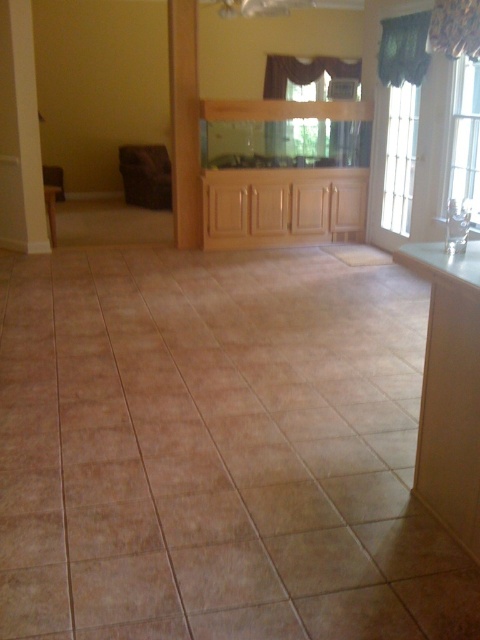
Between brown wood pillar at left and wooden pillar at center, which one has more height?

wooden pillar at center

Which is behind, point (20, 244) or point (180, 246)?

The point (180, 246) is behind.

Who is more distant from viewer, (x=24, y=198) or (x=178, y=125)?

The point (x=178, y=125) is behind.

Locate an element on the screen. brown wood pillar at left is located at coordinates (20, 134).